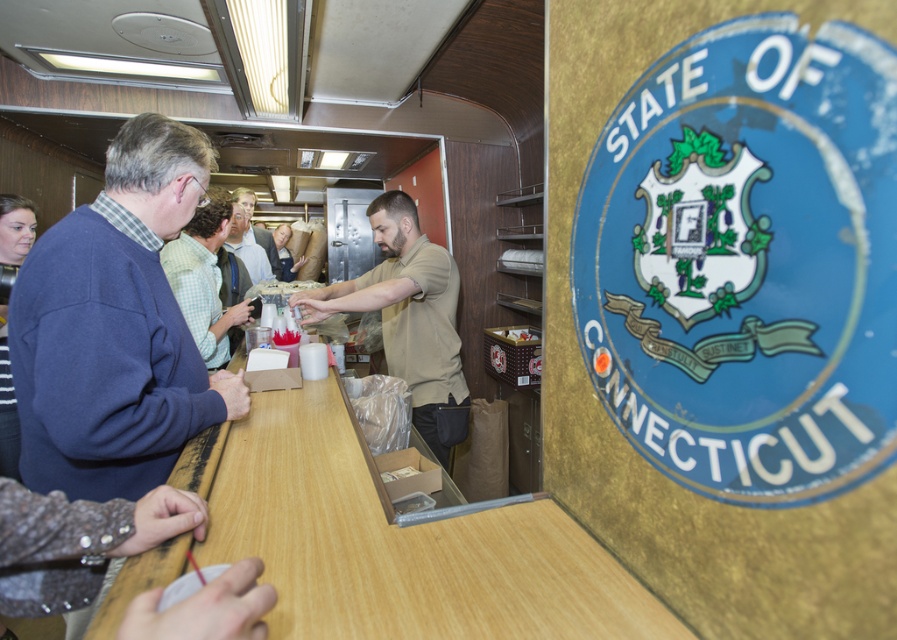
Question: Which is farther from the light brown shirt at center?

Choices:
 (A) wooden at center
 (B) white paper cup at center
 (C) matte khaki shirt at center

Answer: (A)

Question: Among these objects, which one is farthest from the camera?

Choices:
 (A) white paper cup at center
 (B) light brown shirt at center
 (C) wooden at center

Answer: (B)

Question: Is the position of green plaid shirt at center more distant than that of white paper cup at center?

Choices:
 (A) no
 (B) yes

Answer: (A)

Question: Which point is farther from the camera taking this photo?

Choices:
 (A) (192, 288)
 (B) (255, 291)

Answer: (B)

Question: Does wooden at center appear under green plaid shirt at center?

Choices:
 (A) yes
 (B) no

Answer: (A)

Question: Can you confirm if matte khaki shirt at center is thinner than white paper cup at center?

Choices:
 (A) no
 (B) yes

Answer: (A)